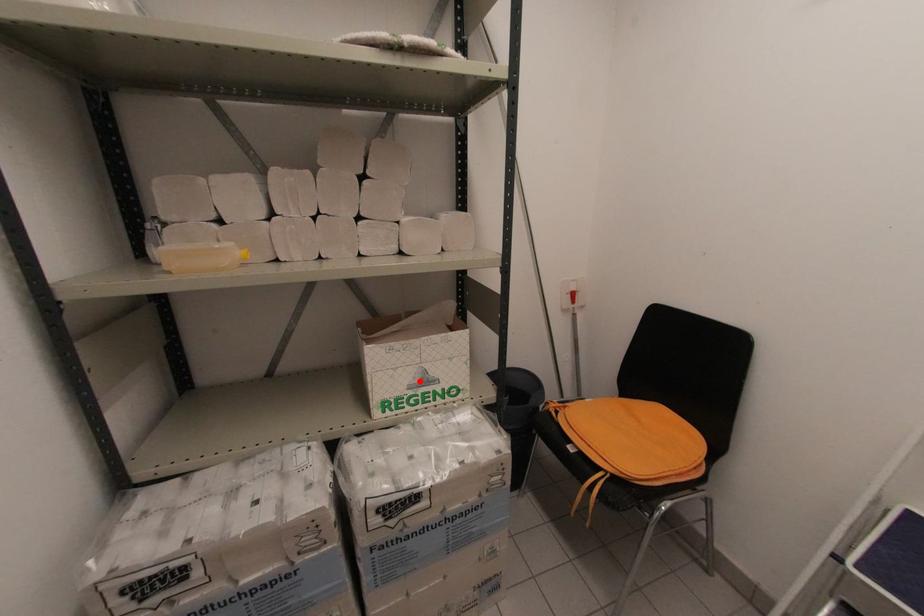
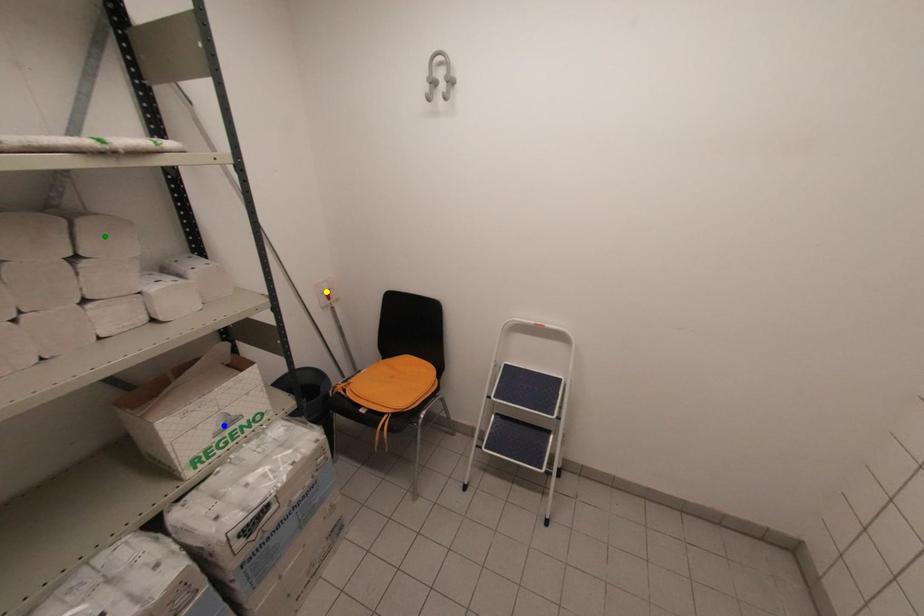
Question: I am providing you with two images of the same scene from different viewpoints. A red point is marked on the first image. You are given multiple points on the second image. Which point in image 2 is actually the same real-world point as the red point in image 1?

Choices:
 (A) yellow point
 (B) green point
 (C) blue point

Answer: (C)